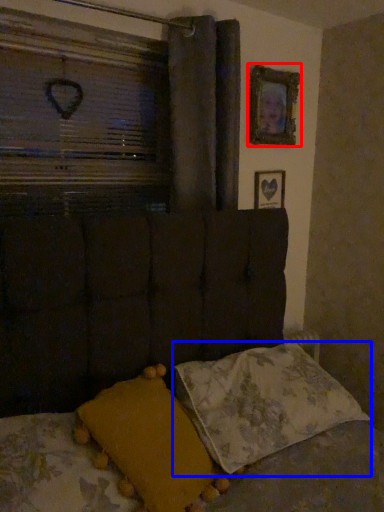
Question: Which point is closer to the camera, picture frame (highlighted by a red box) or pillow (highlighted by a blue box)?

Choices:
 (A) picture frame
 (B) pillow

Answer: (B)